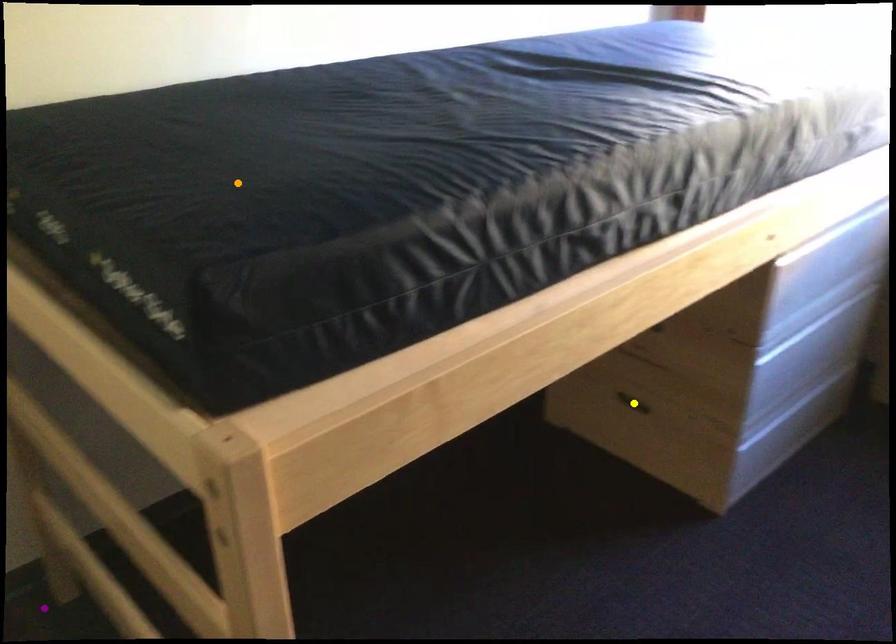
Consider the image. Order these from nearest to farthest:
- yellow point
- orange point
- purple point

yellow point
purple point
orange point